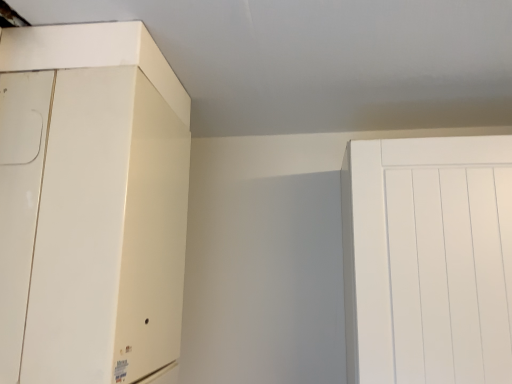
Question: Should I look upward or downward to see matte white cabinet at upper left?

Choices:
 (A) up
 (B) down

Answer: (B)